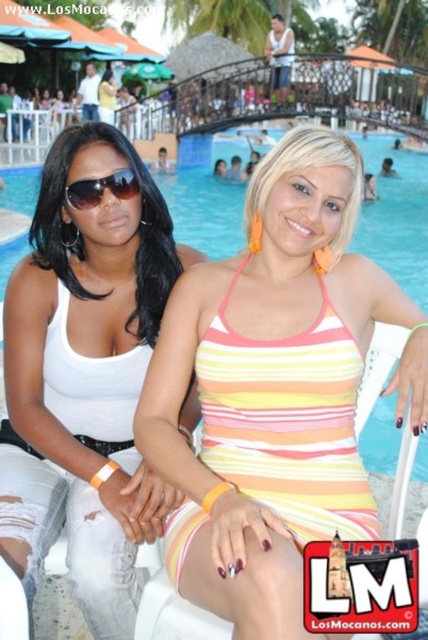
Question: Is striped fabric swimsuit at center smaller than white matte tank top at center?

Choices:
 (A) no
 (B) yes

Answer: (A)

Question: Which is farther from the striped fabric swimsuit at center?

Choices:
 (A) matte black sunglasses at left
 (B) white matte tank top at center

Answer: (A)

Question: Estimate the real-world distances between objects in this image. Which object is farther from the striped fabric swimsuit at center?

Choices:
 (A) white matte tank top at center
 (B) matte black sunglasses at left

Answer: (B)

Question: Can you confirm if striped fabric swimsuit at center is positioned to the right of matte black sunglasses at left?

Choices:
 (A) no
 (B) yes

Answer: (B)

Question: Estimate the real-world distances between objects in this image. Which object is closer to the white matte tank top at center?

Choices:
 (A) striped fabric swimsuit at center
 (B) matte black sunglasses at left

Answer: (A)

Question: Is striped fabric swimsuit at center further to camera compared to matte black sunglasses at left?

Choices:
 (A) no
 (B) yes

Answer: (A)